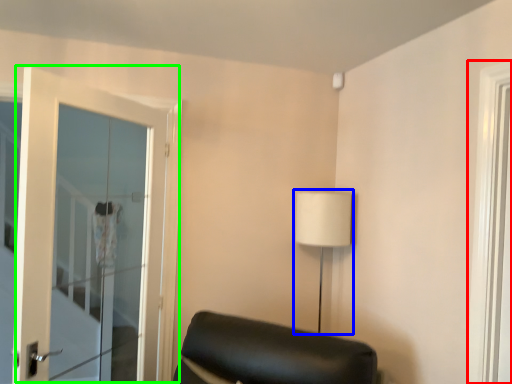
Question: Which is farther away from window (highlighted by a red box)? table lamp (highlighted by a blue box) or door (highlighted by a green box)?

Choices:
 (A) table lamp
 (B) door

Answer: (B)